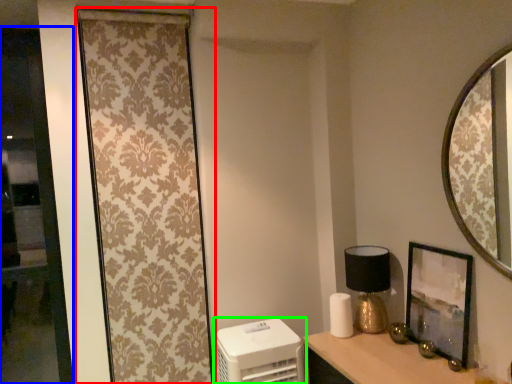
Question: Which is farther away from curtain (highlighted by a red box)? glass door (highlighted by a blue box) or appliance (highlighted by a green box)?

Choices:
 (A) glass door
 (B) appliance

Answer: (B)